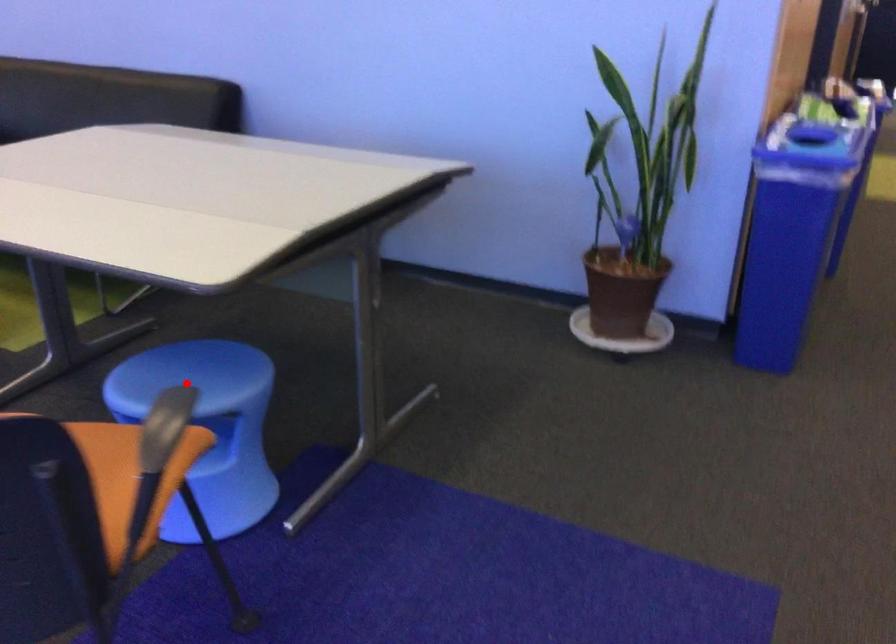
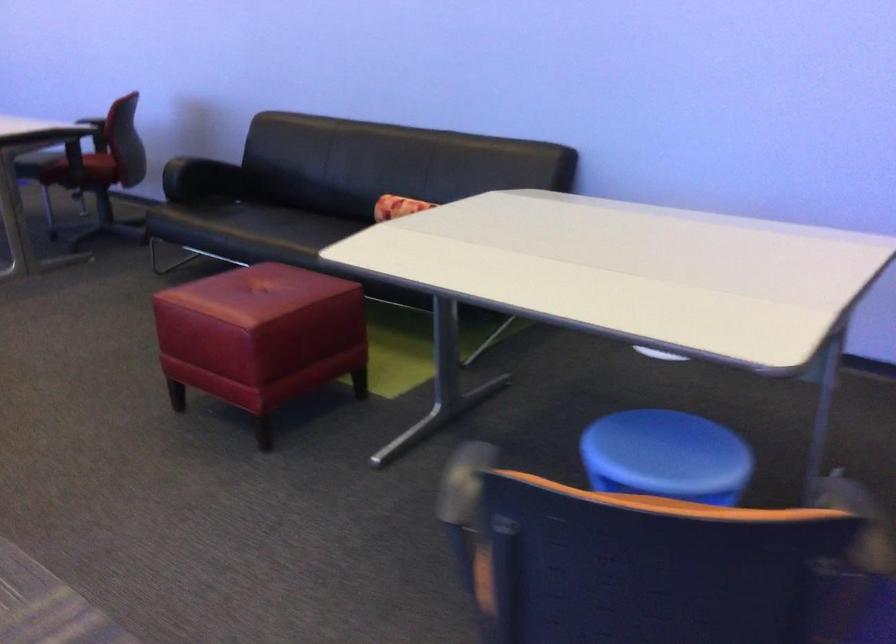
Question: I am providing you with two images of the same scene from different viewpoints. A red point is marked on the first image. Can you still see the location of the red point in image 2?

Choices:
 (A) Yes
 (B) No

Answer: (A)